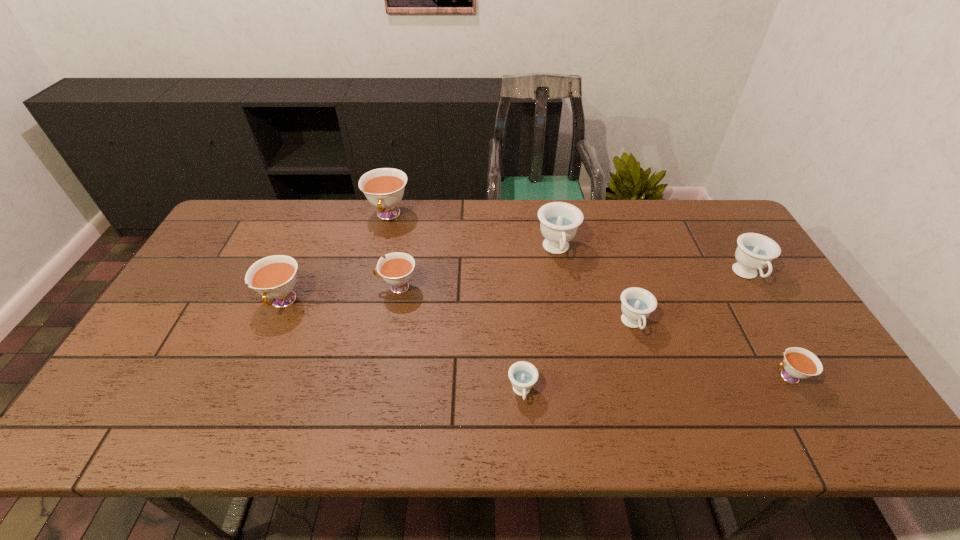
This screenshot has height=540, width=960. In order to click on vacant region at the far left corner in this screenshot , I will do `click(281, 200)`.

Where is `free space between the smallest white teacup and the leftmost teacup`? free space between the smallest white teacup and the leftmost teacup is located at coordinates (536, 340).

Find the location of a particular element. The width and height of the screenshot is (960, 540). vacant space in between the second smallest white teacup and the biggest blue teacup is located at coordinates pos(477,268).

Image resolution: width=960 pixels, height=540 pixels. What are the coordinates of `vacant point located between the second smallest white teacup and the third farthest blue teacup` in the screenshot? It's located at (515, 306).

Identify the location of vacant point located between the sixth teacup from left to right and the nearest white teacup. Image resolution: width=960 pixels, height=540 pixels. (710, 350).

Image resolution: width=960 pixels, height=540 pixels. What are the coordinates of `empty location between the fifth object from right to left and the smallest white teacup` in the screenshot? It's located at (655, 384).

In order to click on free space between the rightmost white teacup and the leftmost blue teacup in this screenshot , I will do `click(655, 384)`.

This screenshot has height=540, width=960. I want to click on free spot between the nearest white teacup and the farthest teacup, so click(588, 296).

Find the location of a particular element. This screenshot has width=960, height=540. blank region between the second biggest white teacup and the farthest teacup is located at coordinates (336, 259).

Identify the location of unoccupied area between the rightmost blue teacup and the second smallest blue teacup. (690, 300).